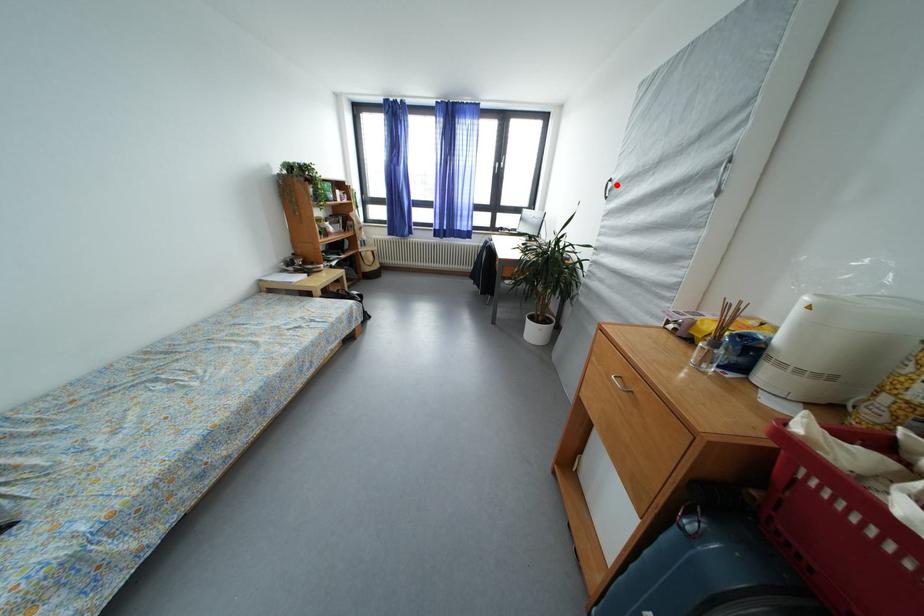
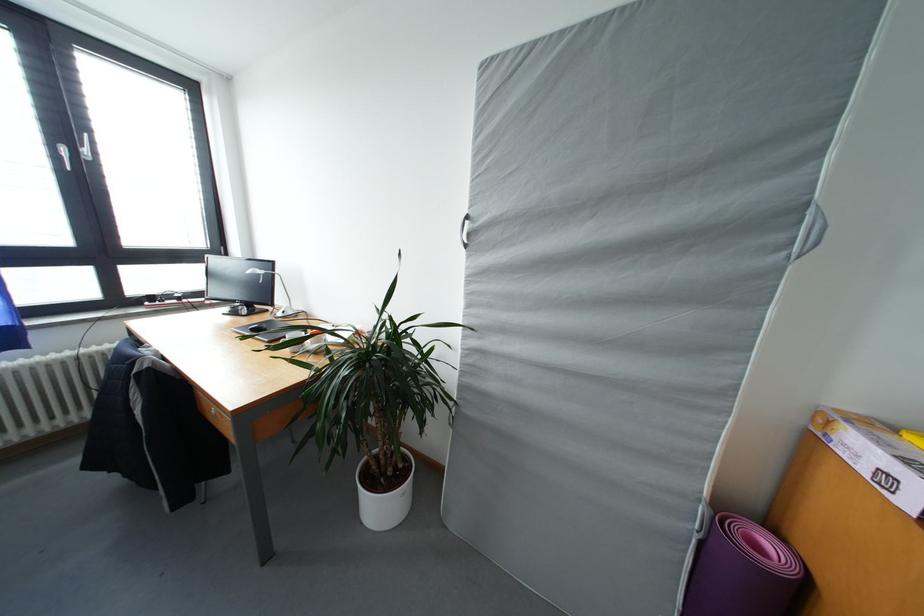
Where in the second image is the point corresponding to the highlighted location from the first image?

(473, 222)